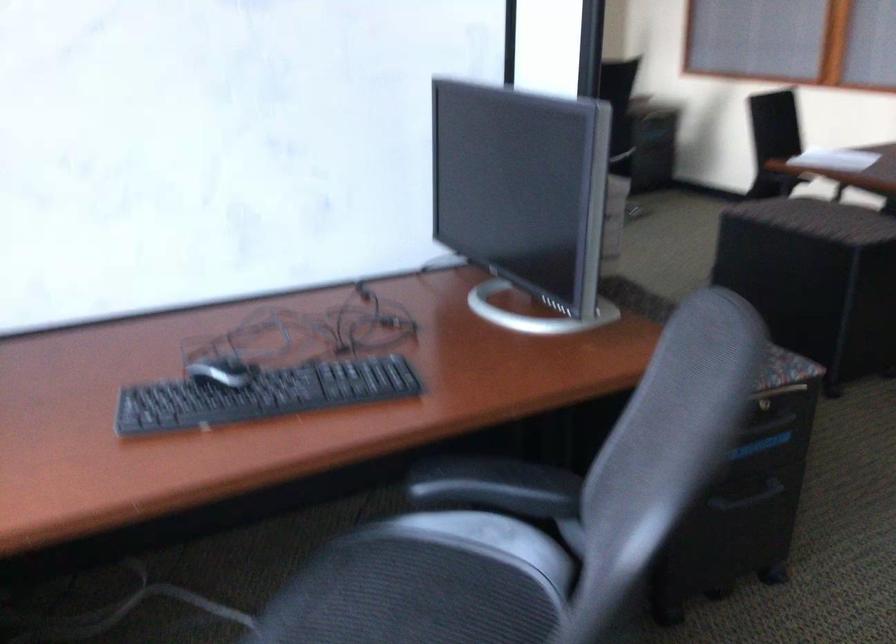
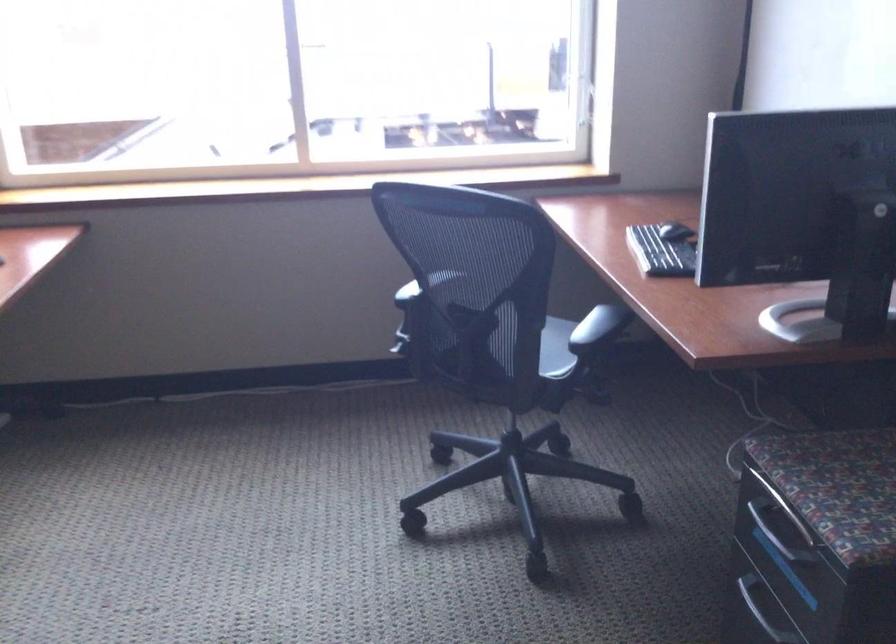
The point at [748,430] is marked in the first image. Where is the corresponding point in the second image?

(776, 532)